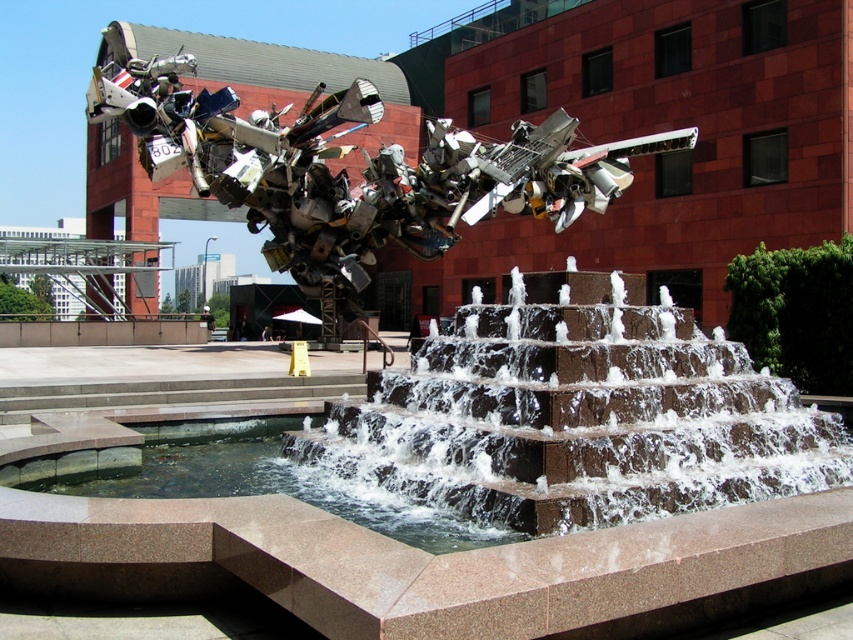
Between point (817, 490) and point (231, 465), which one is positioned in front?

Point (817, 490)

Is point (392, 531) in front of point (500, 520)?

No, (392, 531) is further to viewer.

What do you see at coordinates (561, 422) in the screenshot? The width and height of the screenshot is (853, 640). I see `brown stone fountain at center` at bounding box center [561, 422].

Locate an element on the screen. This screenshot has height=640, width=853. brown stone fountain at center is located at coordinates (561, 422).